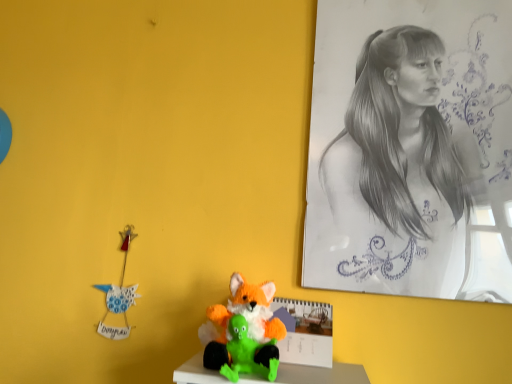
Question: Does graphite sketch at upper right have a greater height compared to fluffy orange and green plush toy at center, which is counted as the second toy, starting from the front?

Choices:
 (A) yes
 (B) no

Answer: (A)

Question: Is fluffy orange and green plush toy at center, which is counted as the second toy, starting from the front, located within graphite sketch at upper right?

Choices:
 (A) no
 (B) yes

Answer: (A)

Question: Can you confirm if graphite sketch at upper right is wider than fluffy orange and green plush toy at center, which is counted as the second toy, starting from the front?

Choices:
 (A) no
 (B) yes

Answer: (A)

Question: Is graphite sketch at upper right positioned behind fluffy orange and green plush toy at center, which ranks as the first toy in back-to-front order?

Choices:
 (A) yes
 (B) no

Answer: (A)

Question: Is graphite sketch at upper right in front of fluffy orange and green plush toy at center, which is counted as the second toy, starting from the front?

Choices:
 (A) no
 (B) yes

Answer: (A)

Question: Is point (234, 365) positioned closer to the camera than point (253, 286)?

Choices:
 (A) closer
 (B) farther

Answer: (A)

Question: Considering the positions of fluffy orange fox at center, placed as the second toy when sorted from back to front, and fluffy orange and green plush toy at center, which ranks as the first toy in back-to-front order, in the image, is fluffy orange fox at center, placed as the second toy when sorted from back to front, bigger or smaller than fluffy orange and green plush toy at center, which ranks as the first toy in back-to-front order,?

Choices:
 (A) big
 (B) small

Answer: (B)

Question: Would you say fluffy orange fox at center, which is counted as the first toy, starting from the front, is to the left or to the right of fluffy orange and green plush toy at center, which ranks as the first toy in back-to-front order, in the picture?

Choices:
 (A) right
 (B) left

Answer: (A)

Question: Is fluffy orange fox at center, which is counted as the first toy, starting from the front, inside or outside of fluffy orange and green plush toy at center, which is counted as the second toy, starting from the front?

Choices:
 (A) outside
 (B) inside

Answer: (B)

Question: Considering the relative positions of graphite sketch at upper right and fluffy orange fox at center, which is counted as the first toy, starting from the front, in the image provided, is graphite sketch at upper right to the left or to the right of fluffy orange fox at center, which is counted as the first toy, starting from the front,?

Choices:
 (A) left
 (B) right

Answer: (B)

Question: Considering the positions of graphite sketch at upper right and fluffy orange fox at center, which is counted as the first toy, starting from the front, in the image, is graphite sketch at upper right bigger or smaller than fluffy orange fox at center, which is counted as the first toy, starting from the front,?

Choices:
 (A) small
 (B) big

Answer: (B)

Question: In terms of height, does graphite sketch at upper right look taller or shorter compared to fluffy orange fox at center, which is counted as the first toy, starting from the front?

Choices:
 (A) tall
 (B) short

Answer: (A)

Question: Looking at their shapes, would you say graphite sketch at upper right is wider or thinner than fluffy orange fox at center, placed as the second toy when sorted from back to front?

Choices:
 (A) thin
 (B) wide

Answer: (A)

Question: In terms of height, does fluffy orange and green plush toy at center, which ranks as the first toy in back-to-front order, look taller or shorter compared to graphite sketch at upper right?

Choices:
 (A) short
 (B) tall

Answer: (A)

Question: Considering the relative positions of fluffy orange and green plush toy at center, which ranks as the first toy in back-to-front order, and graphite sketch at upper right in the image provided, is fluffy orange and green plush toy at center, which ranks as the first toy in back-to-front order, to the left or to the right of graphite sketch at upper right?

Choices:
 (A) left
 (B) right

Answer: (A)